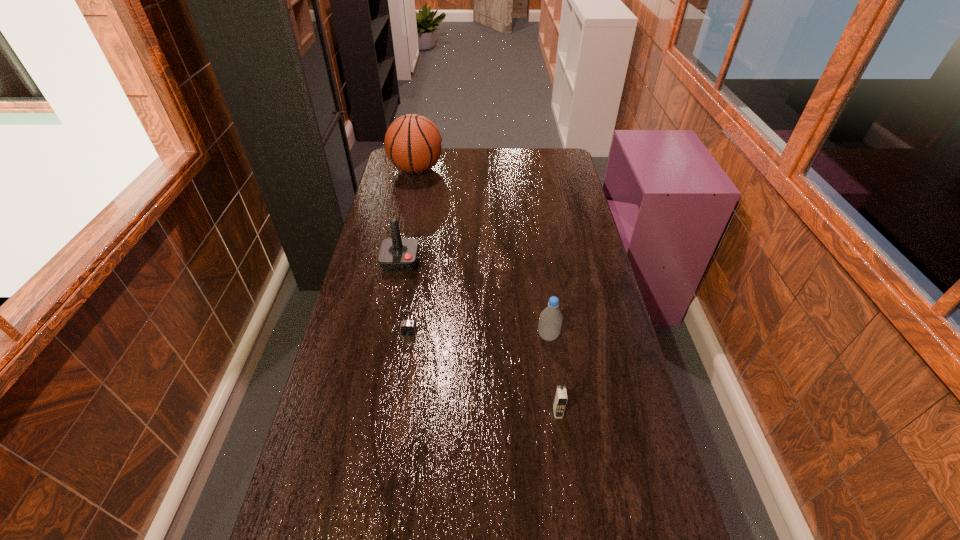
Find the location of a particular element. The height and width of the screenshot is (540, 960). the tallest object is located at coordinates (413, 143).

What are the coordinates of `basketball` in the screenshot? It's located at (413, 143).

Where is `the fourth nearest object`? the fourth nearest object is located at coordinates (396, 254).

Find the location of a particular element. bottle is located at coordinates (550, 321).

Find the location of `cellular telephone`. cellular telephone is located at coordinates (560, 400).

Where is `the shortest object`? This screenshot has width=960, height=540. the shortest object is located at coordinates (408, 328).

Identify the location of blank space located on the side where the inflation valve is located. (477, 170).

Find the location of `free space located 0.240m on the right of the joystick`. free space located 0.240m on the right of the joystick is located at coordinates (483, 261).

Image resolution: width=960 pixels, height=540 pixels. Find the location of `vacant region located on the front of the bottle`. vacant region located on the front of the bottle is located at coordinates (556, 387).

Find the location of a particular element. vacant area situated 0.240m on the front-facing side of the nearest object is located at coordinates (572, 516).